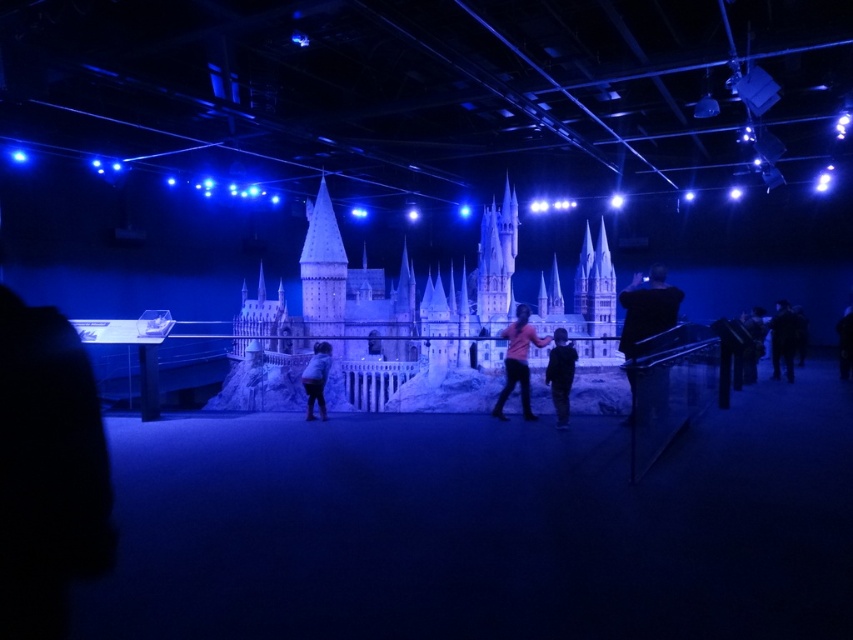
You are standing at the entrance of the exhibition hall and want to take a photo of the Hogwarts Castle model without any people in the frame. The dark clothing figure at right is currently blocking your view. Can you move to the left or right to avoid them?

The dark clothing figure at right is located at point 0.531 on the x axis and 0.919 on the y axis. To avoid them, you can move to the left side of the exhibition space since the figure is positioned towards the right. This should provide an unobstructed view of the Hogwarts Castle model.

You are standing at the point marked as point (x=514, y=323) in the exhibition hall. You want to take a photo of the Hogwarts Castle model without any obstructions. The camera you are using has a maximum range of 450 feet. Can you capture the Hogwarts Castle model from your current position?

The distance between point (x=514, y=323) and the camera is 447.85 feet, which is within the camera maximum range of 450 feet. Therefore, you can capture the Hogwarts Castle model from your current position.